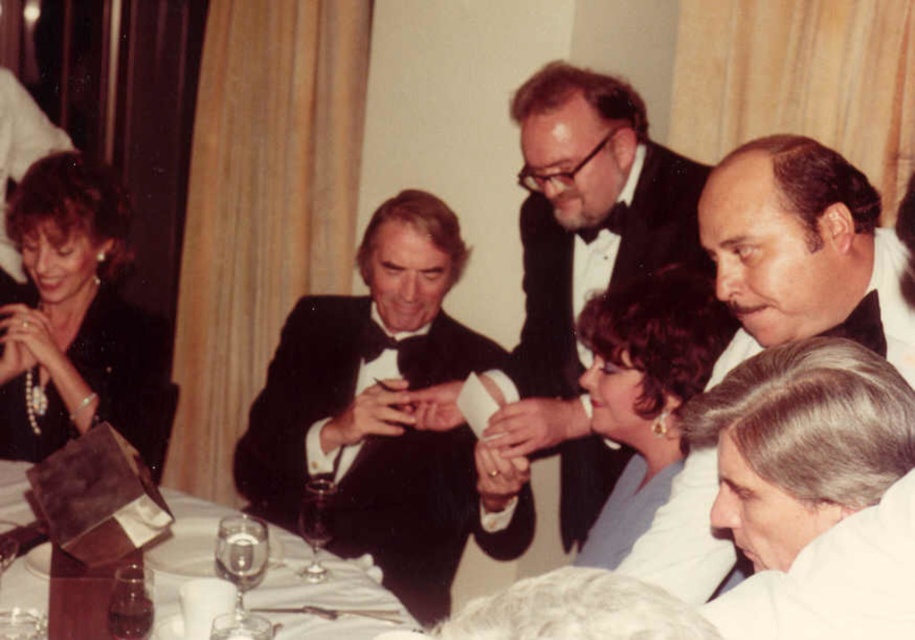
You are a guest at this formal dinner and need to check if your accessories are properly placed. Which accessory is positioned to the right of the other between the black satin bow tie at upper right and the pearl necklace at upper left?

A: The black satin bow tie at upper right is to the right of the pearl necklace at upper left.

You are a guest at this formal dinner and want to adjust your pearl necklace at upper left so it doesn not get tangled with the white fabric at lower right. Which item is closer to you, the guest?

The pearl necklace at upper left is closer to you than the white fabric at lower right, so you can adjust it without worrying about tangling with the fabric behind it.

You are a photographer at the dinner event and need to position a camera to capture the black satin bow tie at upper right. The camera can only focus on objects within a 0.3 unit radius around the point. Is the bow tie within this focus range?

The black satin bow tie at upper right is located at point (803, 252). Since the camera focuses within a 0.3 unit radius, it can capture the bow tie as it is within the required range.